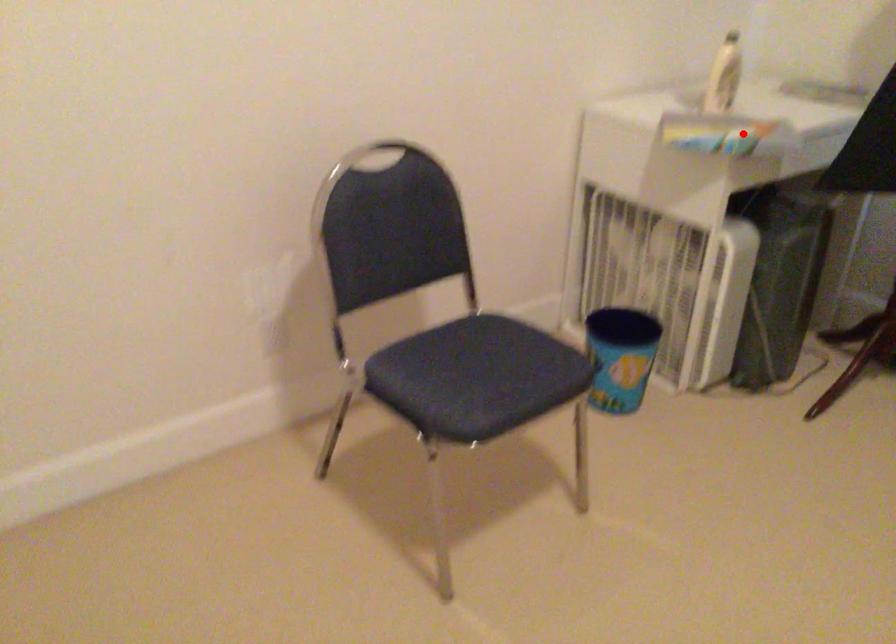
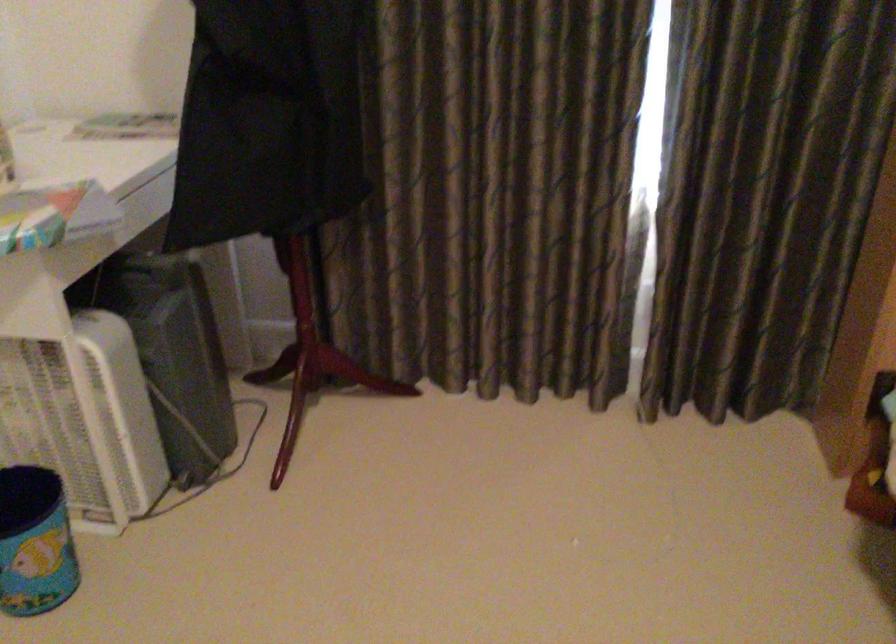
Find the pixel in the second image that matches the highlighted location in the first image.

(54, 214)